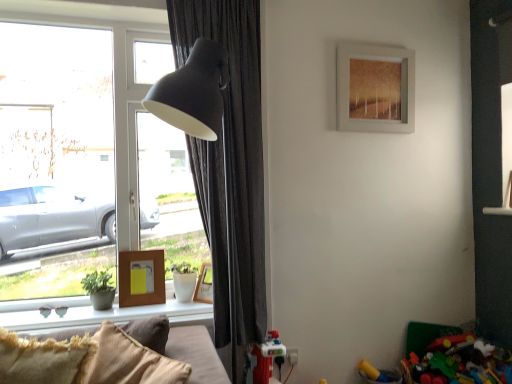
Find the location of a particular element. This screenshot has width=512, height=384. free spot above smooth concrete window sill at lower left (from a real-world perspective) is located at coordinates (111, 307).